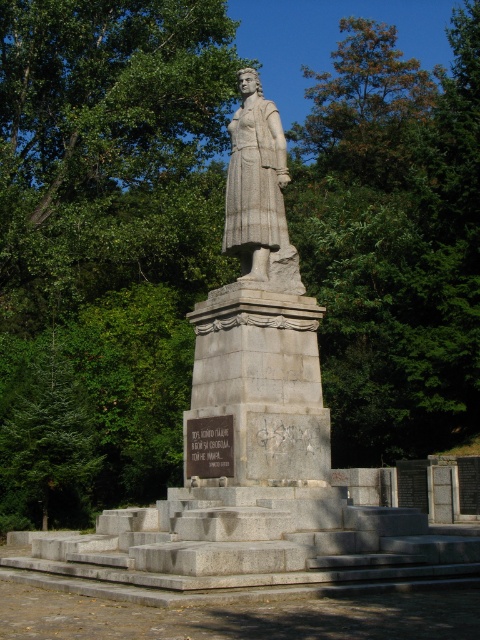
Can you confirm if green leafy tree at upper center is bigger than green leafy tree at center?

Yes, green leafy tree at upper center is bigger than green leafy tree at center.

Between green leafy tree at upper center and green leafy tree at center, which one appears on the left side from the viewer's perspective?

From the viewer's perspective, green leafy tree at center appears more on the left side.

Identify the location of green leafy tree at upper center. The height and width of the screenshot is (640, 480). (365, 108).

Who is more distant from viewer, (242, 202) or (273, 248)?

The point (273, 248) is behind.

Can you confirm if gray stone statue at center is positioned to the right of granite statue at center?

No, gray stone statue at center is not to the right of granite statue at center.

This screenshot has width=480, height=640. What do you see at coordinates (261, 317) in the screenshot?
I see `gray stone statue at center` at bounding box center [261, 317].

The width and height of the screenshot is (480, 640). I want to click on gray stone statue at center, so click(261, 317).

Who is more forward, (280, 192) or (213, 476)?

Point (213, 476) is more forward.

The height and width of the screenshot is (640, 480). Describe the element at coordinates (257, 189) in the screenshot. I see `granite statue at center` at that location.

Where is `granite statue at center`? granite statue at center is located at coordinates (257, 189).